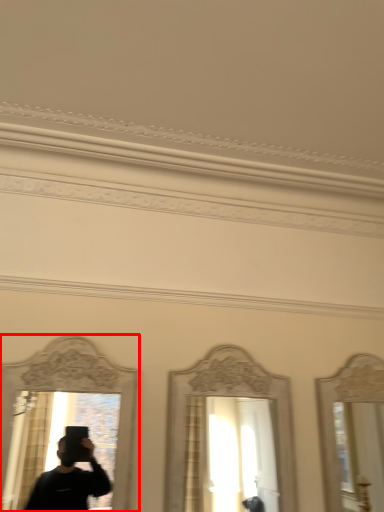
Question: Observing the image, what is the correct spatial positioning of mirror (annotated by the red box) in reference to mirror?

Choices:
 (A) right
 (B) left

Answer: (B)